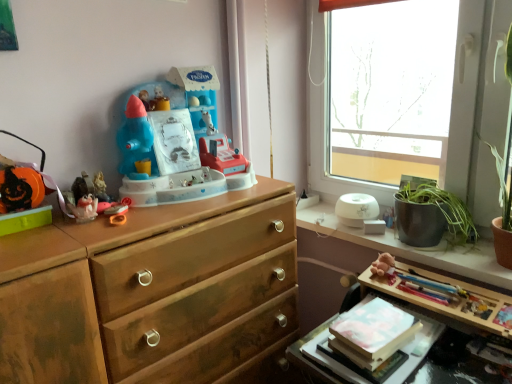
Identify the location of free region under green leafy plant at window sill (from a real-world perspective). The image size is (512, 384). (428, 243).